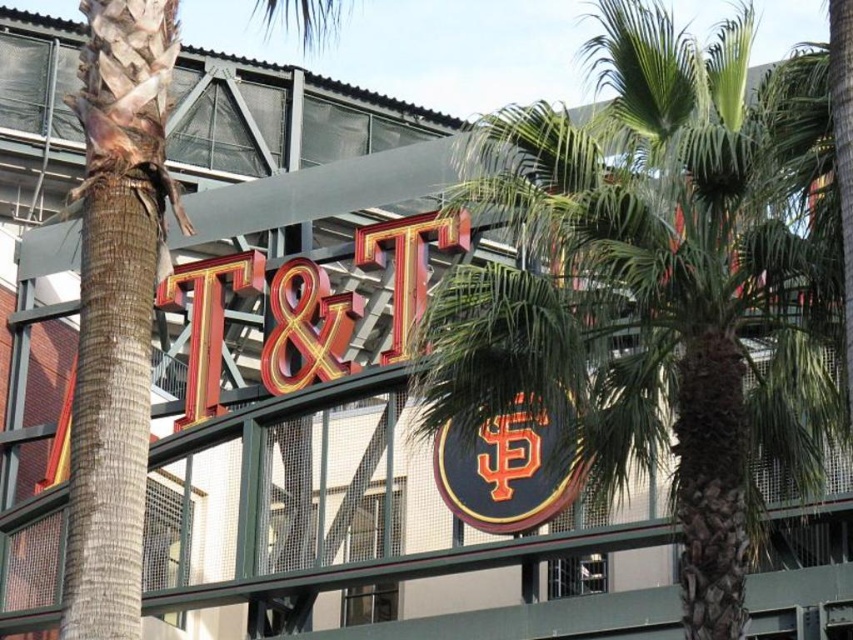
Question: Which point is closer to the camera taking this photo?

Choices:
 (A) (141, 168)
 (B) (538, 452)
 (C) (730, 576)
 (D) (299, 259)

Answer: (C)

Question: Which object appears farthest from the camera in this image?

Choices:
 (A) green leafy palm tree at left
 (B) shiny gold sign at center

Answer: (B)

Question: Can you confirm if green leafy palm tree at center is positioned above orange glossy logo at center?

Choices:
 (A) yes
 (B) no

Answer: (A)

Question: Does green leafy palm tree at center appear on the left side of shiny gold sign at center?

Choices:
 (A) yes
 (B) no

Answer: (B)

Question: Which point is closer to the camera?

Choices:
 (A) green leafy palm tree at left
 (B) shiny gold sign at center

Answer: (A)

Question: In this image, where is green leafy palm tree at center located relative to orange glossy logo at center?

Choices:
 (A) left
 (B) right

Answer: (B)